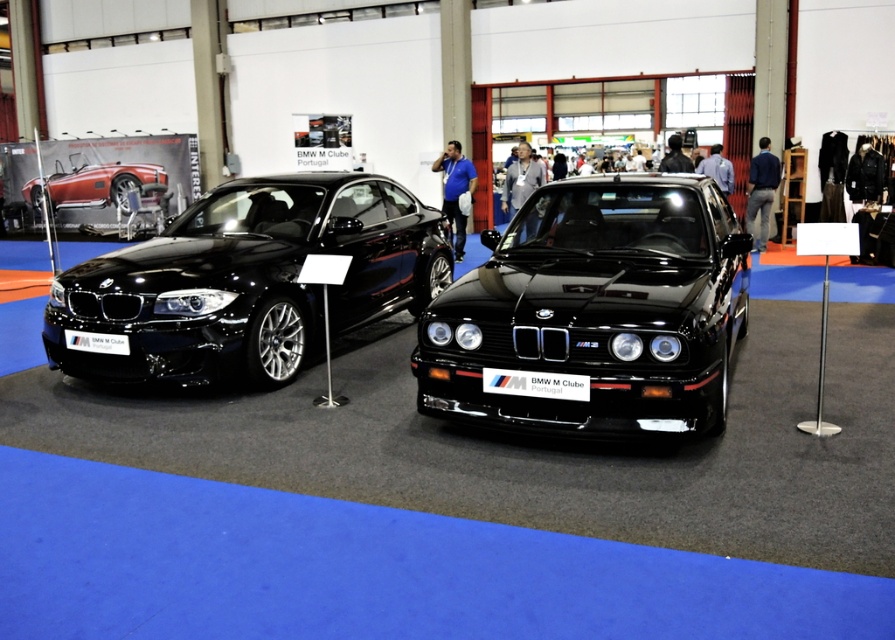
You are a tour guide leading a group through the car exhibition. You need to move a 10 meter long banner between the two cars. Can you fit the banner between the matte black car at left and the metallic red car at left without touching either car?

The distance between the matte black car at left and the metallic red car at left is 12.35 meters. Since the banner is 10 meters long, there is enough space to place it between them without touching either car.

You are a tour guide giving a tour of the BMW exhibition. You need to direct visitors to the metallic red car at left. Where exactly is it located in the room?

The metallic red car at left is located at point [101,182] in the room.

You are a photographer setting up for a car showcase. You need to ensure that the white plastic license plate at lower left is visible in the photo without obstruction. Given that the metallic red car at left is currently blocking it, where should you position yourself to capture both objects clearly?

The white plastic license plate at lower left is behind the metallic red car at left, so to capture both clearly, position yourself in front of the metallic red car at left so that the license plate is visible behind it without obstruction.